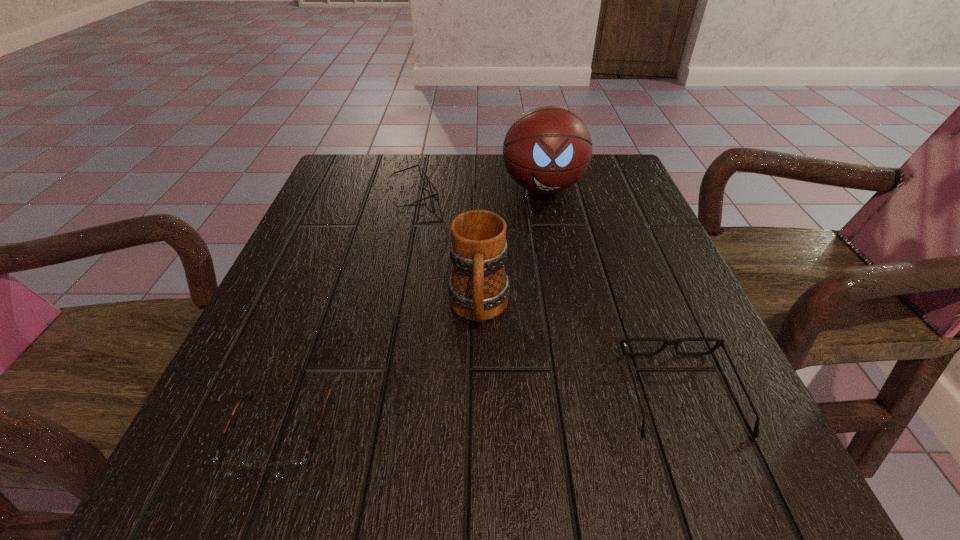
Find the location of `free space located on the front-facing side of the rightmost spectacles`. free space located on the front-facing side of the rightmost spectacles is located at coordinates (638, 284).

Find the location of a particular element. The height and width of the screenshot is (540, 960). basketball at the far edge is located at coordinates point(548,149).

The image size is (960, 540). I want to click on spectacles present at the far edge, so click(x=422, y=174).

Find the location of a particular element. Image resolution: width=960 pixels, height=540 pixels. object at the near edge is located at coordinates (288, 469).

The height and width of the screenshot is (540, 960). I want to click on object that is at the left edge, so click(x=288, y=469).

Find the location of a particular element. basketball that is at the right edge is located at coordinates [x=548, y=149].

I want to click on spectacles located in the right edge section of the desktop, so click(719, 342).

Identify the location of object present at the near left corner. (288, 469).

You are a GUI agent. You are given a task and a screenshot of the screen. Output one action in this format:
    pyautogui.click(x=<x>, y=<y>)
    Task: Click on the object that is at the far right corner
    This screenshot has width=960, height=540.
    Given the screenshot: What is the action you would take?
    pyautogui.click(x=548, y=149)

The height and width of the screenshot is (540, 960). In the image, there is a desktop. What are the coordinates of `free region at the far edge` in the screenshot? It's located at (447, 159).